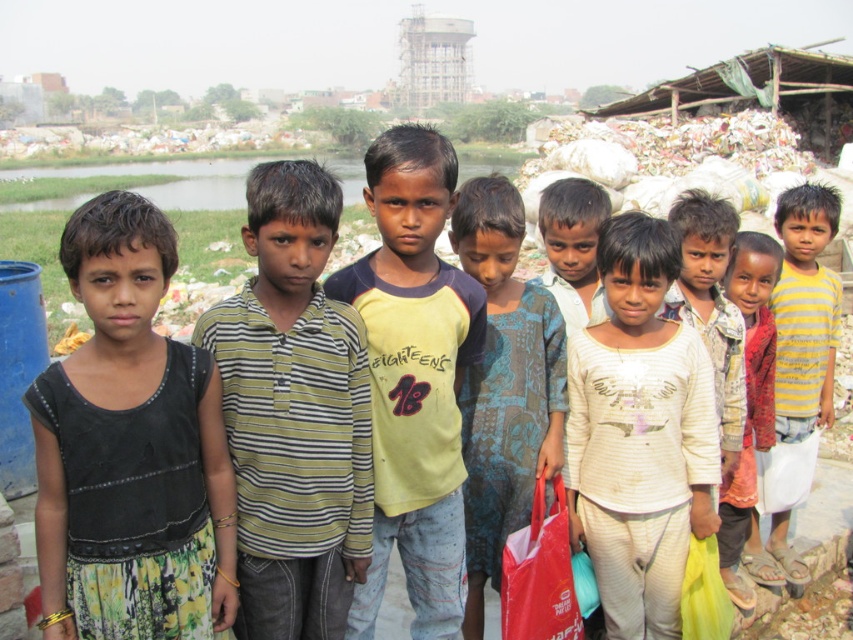
Is point (610, 321) positioned after point (685, 262)?

No, it is not.

Which is behind, point (587, 538) or point (721, 374)?

The point (721, 374) is more distant.

Image resolution: width=853 pixels, height=640 pixels. In order to click on white striped shirt at center in this screenshot , I will do `click(639, 435)`.

Is striped cotton shirt at center positioned before yellow striped shirt at center?

Yes, it is in front of yellow striped shirt at center.

Between striped cotton shirt at center and yellow striped shirt at center, which one is positioned lower?

striped cotton shirt at center is lower down.

Describe the element at coordinates (293, 413) in the screenshot. I see `striped cotton shirt at center` at that location.

Locate an element on the screen. striped cotton shirt at center is located at coordinates (293, 413).

Can you confirm if striped cotton shirt at center is shorter than white striped shirt at center?

No.

Which of these two, striped cotton shirt at center or white striped shirt at center, stands shorter?

white striped shirt at center is shorter.

Where is `striped cotton shirt at center`? This screenshot has width=853, height=640. striped cotton shirt at center is located at coordinates (293, 413).